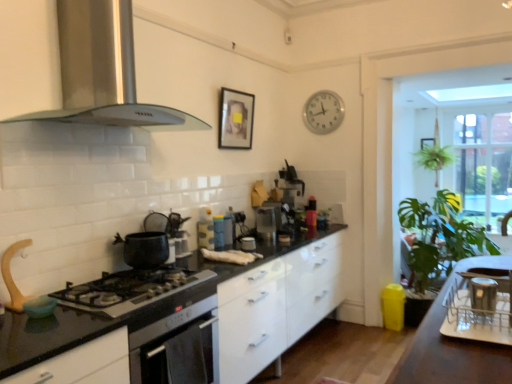
Locate an element on the screen. matte black kettle at center, positioned as the third appliance in front-to-back order is located at coordinates (248, 244).

How much space does stainless steel range hood at upper left, which is the first kitchen appliance in top-to-bottom order, occupy horizontally?

The width of stainless steel range hood at upper left, which is the first kitchen appliance in top-to-bottom order, is 17.49 inches.

At what (x,y) coordinates should I click in order to perform the action: click on green leafy plant at right. Please return your answer as a coordinate pair (x, y). Looking at the image, I should click on (440, 238).

Considering the sizes of matte black kettle at center, positioned as the 4th appliance in right-to-left order, and green leafy plant at right in the image, is matte black kettle at center, positioned as the 4th appliance in right-to-left order, taller or shorter than green leafy plant at right?

Considering their sizes, matte black kettle at center, positioned as the 4th appliance in right-to-left order, has less height than green leafy plant at right.

From the image's perspective, is matte black kettle at center, the second appliance in the left-to-right sequence, above green leafy plant at right?

Correct, matte black kettle at center, the second appliance in the left-to-right sequence, appears higher than green leafy plant at right in the image.

The image size is (512, 384). I want to click on plant that is behind the matte black kettle at center, the second appliance in the left-to-right sequence, so click(x=440, y=238).

From a real-world perspective, is black glossy countertop at center physically located above or below matte black picture frame at upper center, which appears as the second picture frame when viewed from the right?

In terms of real-world spatial position, black glossy countertop at center is below matte black picture frame at upper center, which appears as the second picture frame when viewed from the right.

Is black glossy countertop at center to the right of matte black picture frame at upper center, which is the 1th picture frame from front to back, from the viewer's perspective?

In fact, black glossy countertop at center is to the left of matte black picture frame at upper center, which is the 1th picture frame from front to back.

Can you see black glossy countertop at center touching matte black picture frame at upper center, which appears as the second picture frame when viewed from the right?

They are not placed beside each other.

Is matte blue thermos at center, which appears as the 2th appliance when viewed from the back, outside of silver metallic clock at upper center?

matte blue thermos at center, which appears as the 2th appliance when viewed from the back, lies outside silver metallic clock at upper center's area.

Based on their sizes in the image, would you say matte blue thermos at center, the fourth appliance when ordered from front to back, is bigger or smaller than silver metallic clock at upper center?

Considering their sizes, matte blue thermos at center, the fourth appliance when ordered from front to back, takes up less space than silver metallic clock at upper center.

Is matte blue thermos at center, which appears as the 2th appliance when viewed from the back, closer to camera compared to silver metallic clock at upper center?

That is True.

In the scene shown: From the image's perspective, is matte blue thermos at center, which appears as the 2th appliance when viewed from the back, located above or below silver metallic clock at upper center?

Based on their image positions, matte blue thermos at center, which appears as the 2th appliance when viewed from the back, is located beneath silver metallic clock at upper center.

From a real-world perspective, which is physically above, silver metallic clock at upper center or matte blue thermos at center, the fourth appliance when ordered from front to back?

silver metallic clock at upper center.

Can you confirm if silver metallic clock at upper center is positioned to the right of matte blue thermos at center, acting as the fifth appliance starting from the right?

Yes.

Is silver metallic clock at upper center positioned beyond the bounds of matte blue thermos at center, the fourth appliance when ordered from front to back?

Yes, silver metallic clock at upper center is not within matte blue thermos at center, the fourth appliance when ordered from front to back.

Does silver metallic dish rack at right, placed as the first appliance when sorted from front to back, turn towards wooden framed picture at upper center, arranged as the second picture frame when viewed from the front?

Yes, silver metallic dish rack at right, placed as the first appliance when sorted from front to back, is aimed at wooden framed picture at upper center, arranged as the second picture frame when viewed from the front.

Based on their positions, is silver metallic dish rack at right, which ranks as the 1th appliance in right-to-left order, located to the left or right of wooden framed picture at upper center, the first picture frame viewed from the back?

Clearly, silver metallic dish rack at right, which ranks as the 1th appliance in right-to-left order, is on the left of wooden framed picture at upper center, the first picture frame viewed from the back, in the image.

Is point (441, 333) closer to camera compared to point (422, 143)?

That is True.

Would you say silver metallic dish rack at right, which ranks as the 1th appliance in right-to-left order, is outside wooden framed picture at upper center, the first picture frame viewed from the back?

Indeed, silver metallic dish rack at right, which ranks as the 1th appliance in right-to-left order, is completely outside wooden framed picture at upper center, the first picture frame viewed from the back.

Considering the sizes of objects wooden framed picture at upper center, arranged as the 2th picture frame when viewed from the left, and metallic silver kettle at center, which appears as the first appliance when viewed from the back, in the image provided, who is smaller, wooden framed picture at upper center, arranged as the 2th picture frame when viewed from the left, or metallic silver kettle at center, which appears as the first appliance when viewed from the back,?

Smaller between the two is wooden framed picture at upper center, arranged as the 2th picture frame when viewed from the left.

Does wooden framed picture at upper center, arranged as the 2th picture frame when viewed from the left, have a lesser width compared to metallic silver kettle at center, which is counted as the 3th appliance, starting from the right?

Yes.

Between wooden framed picture at upper center, arranged as the second picture frame when viewed from the front, and metallic silver kettle at center, which appears as the first appliance when viewed from the back, which one has less height?

wooden framed picture at upper center, arranged as the second picture frame when viewed from the front.

From the image's perspective, between wooden framed picture at upper center, arranged as the 2th picture frame when viewed from the left, and metallic silver kettle at center, which ranks as the 5th appliance in front-to-back order, who is located below?

From the image's view, metallic silver kettle at center, which ranks as the 5th appliance in front-to-back order, is below.

From the image's perspective, between matte black kettle at center, which is the 3th appliance in back-to-front order, and silver metallic clock at upper center, which one is located above?

silver metallic clock at upper center.

Is matte black kettle at center, positioned as the third appliance in front-to-back order, spatially inside silver metallic clock at upper center, or outside of it?

matte black kettle at center, positioned as the third appliance in front-to-back order, exists outside the volume of silver metallic clock at upper center.

Which object is closer to the camera taking this photo, matte black kettle at center, which is the 3th appliance in back-to-front order, or silver metallic clock at upper center?

matte black kettle at center, which is the 3th appliance in back-to-front order, is in front.

Is silver metallic clock at upper center at the back of matte black kettle at center, positioned as the third appliance in front-to-back order?

matte black kettle at center, positioned as the third appliance in front-to-back order, does not have its back to silver metallic clock at upper center.

Which appliance is the 4th one when counting from the left side of the green leafy plant at right? Please provide its 2D coordinates.

[(248, 244)]

Find the location of `the 2nd picture frame positioned above the black glossy countertop at center (from a real-world perspective)`. the 2nd picture frame positioned above the black glossy countertop at center (from a real-world perspective) is located at coordinates (234, 119).

Based on their spatial positions, is metallic silver container at upper right, which is the 4th appliance from back to front, or metallic silver kettle at center, which appears as the first appliance when viewed from the back, closer to green leafy plant at right?

metallic silver kettle at center, which appears as the first appliance when viewed from the back, is closer to green leafy plant at right.

Which object lies nearer to the anchor point matte black picture frame at upper center, which appears as the second picture frame when viewed from the right, clear glass window at right or silver metallic clock at upper center?

The object closer to matte black picture frame at upper center, which appears as the second picture frame when viewed from the right, is silver metallic clock at upper center.

Looking at the image, which one is located closer to matte black picture frame at upper center, the second picture frame from the back, matte blue thermos at center, which is the 1th appliance in left-to-right order, or silver metallic dish rack at right, placed as the first appliance when sorted from front to back?

Based on the image, matte blue thermos at center, which is the 1th appliance in left-to-right order, appears to be nearer to matte black picture frame at upper center, the second picture frame from the back.

When comparing their distances from wooden framed picture at upper center, arranged as the second picture frame when viewed from the front, does matte blue thermos at center, which is the 1th appliance in left-to-right order, or matte black picture frame at upper center, positioned as the first picture frame in left-to-right order, seem further?

The object further to wooden framed picture at upper center, arranged as the second picture frame when viewed from the front, is matte blue thermos at center, which is the 1th appliance in left-to-right order.

When comparing their distances from silver metallic clock at upper center, does metallic silver container at upper right, the fourth appliance positioned from the left, or metallic silver kettle at center, which ranks as the 5th appliance in front-to-back order, seem closer?

Among the two, metallic silver kettle at center, which ranks as the 5th appliance in front-to-back order, is located nearer to silver metallic clock at upper center.

From the picture: Which object lies nearer to the anchor point stainless steel range hood at upper left, which is the second kitchen appliance in bottom-to-top order, matte black kettle at center, positioned as the third appliance in front-to-back order, or metallic silver kettle at center, placed as the third appliance when sorted from left to right?

Among the two, matte black kettle at center, positioned as the third appliance in front-to-back order, is located nearer to stainless steel range hood at upper left, which is the second kitchen appliance in bottom-to-top order.

Looking at the image, which one is located further to black matte gas stove at center, metallic silver kettle at center, which appears as the first appliance when viewed from the back, or black glossy countertop at center?

metallic silver kettle at center, which appears as the first appliance when viewed from the back.

Which object lies further to the anchor point silver metallic dish rack at right, which ranks as the 5th appliance in back-to-front order, green leafy plant at right or wooden framed picture at upper center, the first picture frame viewed from the back?

wooden framed picture at upper center, the first picture frame viewed from the back.

Where is `gas stove between silver metallic dish rack at right, which ranks as the 1th appliance in right-to-left order, and matte blue thermos at center, which is the 1th appliance in left-to-right order, along the z-axis`? gas stove between silver metallic dish rack at right, which ranks as the 1th appliance in right-to-left order, and matte blue thermos at center, which is the 1th appliance in left-to-right order, along the z-axis is located at coordinates (128, 290).

Where is `gas stove located between stainless steel range hood at upper left, which is the first kitchen appliance in top-to-bottom order, and green leafy plant at right in the left-right direction`? This screenshot has width=512, height=384. gas stove located between stainless steel range hood at upper left, which is the first kitchen appliance in top-to-bottom order, and green leafy plant at right in the left-right direction is located at coordinates (128, 290).

You are a GUI agent. You are given a task and a screenshot of the screen. Output one action in this format:
    pyautogui.click(x=<x>, y=<y>)
    Task: Click on the gas stove between stainless steel range hood at upper left, which is the first kitchen appliance in top-to-bottom order, and matte blue thermos at center, which appears as the 2th appliance when viewed from the back, in the front-back direction
    This screenshot has height=384, width=512.
    Given the screenshot: What is the action you would take?
    pyautogui.click(x=128, y=290)

The image size is (512, 384). I want to click on picture frame positioned between black glossy countertop at center and clear glass window at right from near to far, so click(x=234, y=119).